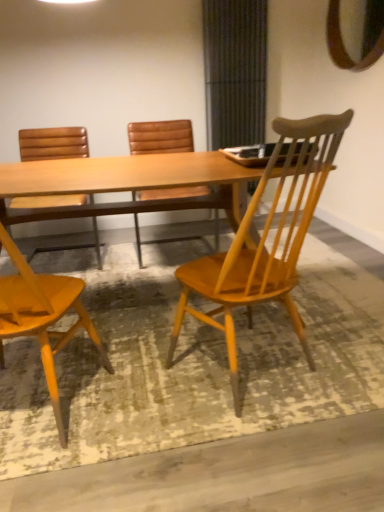
At what (x,y) coordinates should I click in order to perform the action: click on free spot to the right of wooden chair at center, arranged as the 4th chair when viewed from the left. Please return your answer as a coordinate pair (x, y). The height and width of the screenshot is (512, 384). Looking at the image, I should click on click(345, 357).